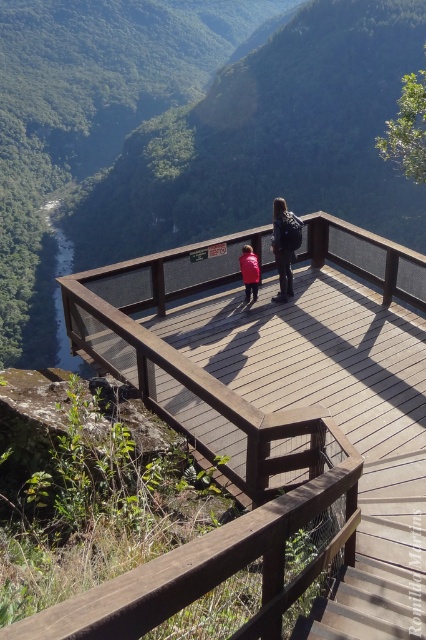
Question: Is green matte wooden platform at center positioned behind brown wooden bridge at center?

Choices:
 (A) no
 (B) yes

Answer: (B)

Question: Which of the following is the farthest from the observer?

Choices:
 (A) (37, 636)
 (B) (328, 381)
 (C) (183, 90)
 (D) (245, 276)

Answer: (C)

Question: Which object is the closest to the green matte wooden platform at center?

Choices:
 (A) red matte jacket at center
 (B) brown wooden rail at lower left
 (C) brown wooden bridge at center

Answer: (C)

Question: Is green matte wooden platform at center above brown wooden bridge at center?

Choices:
 (A) yes
 (B) no

Answer: (A)

Question: Is brown wooden bridge at center to the left of red matte jacket at center from the viewer's perspective?

Choices:
 (A) no
 (B) yes

Answer: (A)

Question: Estimate the real-world distances between objects in this image. Which object is farther from the brown wooden rail at lower left?

Choices:
 (A) green matte wooden platform at center
 (B) red matte jacket at center
 (C) brown wooden bridge at center

Answer: (A)